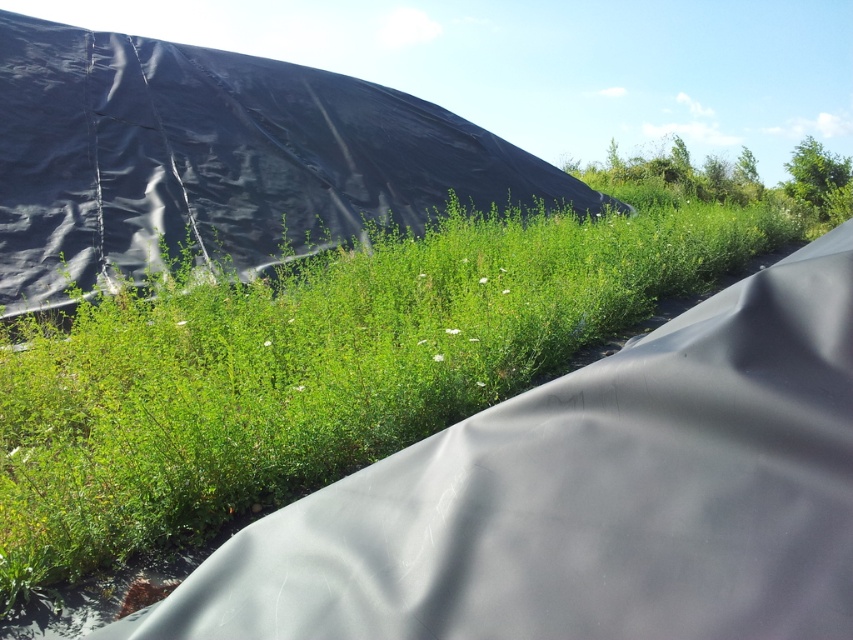
Question: Which point is farther to the camera?

Choices:
 (A) (148, 596)
 (B) (56, 220)
 (C) (94, 467)

Answer: (B)

Question: From the image, what is the correct spatial relationship of green matte grass at center in relation to black tarp at upper left?

Choices:
 (A) below
 (B) above

Answer: (A)

Question: Which object is positioned farthest from the black tarp at upper left?

Choices:
 (A) green matte grass at center
 (B) metallic silver rock at lower left

Answer: (B)

Question: Can you confirm if green matte grass at center is thinner than black tarp at upper left?

Choices:
 (A) yes
 (B) no

Answer: (A)

Question: Among these objects, which one is farthest from the camera?

Choices:
 (A) black tarp at upper left
 (B) green matte grass at center
 (C) metallic silver rock at lower left

Answer: (A)

Question: Is green matte grass at center in front of metallic silver rock at lower left?

Choices:
 (A) no
 (B) yes

Answer: (A)